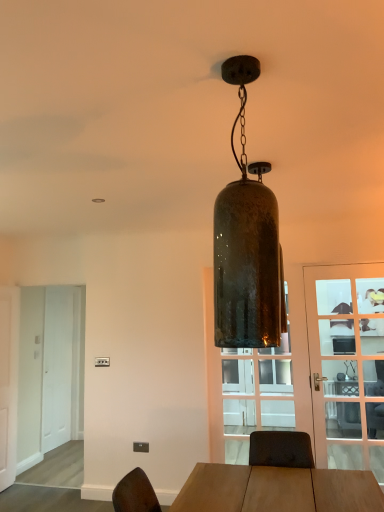
Question: Does green glass pendant light at center have a smaller size compared to white matte door at left, the 1th door from the left?

Choices:
 (A) no
 (B) yes

Answer: (B)

Question: Can you confirm if green glass pendant light at center is positioned to the left of white matte door at left, the 2th door viewed from the right?

Choices:
 (A) no
 (B) yes

Answer: (A)

Question: Considering the relative sizes of green glass pendant light at center and white matte door at left, the 1th door from the left, in the image provided, is green glass pendant light at center wider than white matte door at left, the 1th door from the left,?

Choices:
 (A) no
 (B) yes

Answer: (B)

Question: Is green glass pendant light at center placed right next to white matte door at left, the 2th door viewed from the right?

Choices:
 (A) no
 (B) yes

Answer: (A)

Question: Does green glass pendant light at center turn towards white matte door at left, the 2th door viewed from the right?

Choices:
 (A) yes
 (B) no

Answer: (B)

Question: From a real-world perspective, is white matte door at left, positioned as the second screen door in back-to-front order, positioned above or below clear glass door at center right, the first door positioned from the right?

Choices:
 (A) below
 (B) above

Answer: (A)

Question: Based on their positions, is white matte door at left, positioned as the second screen door in back-to-front order, located to the left or right of clear glass door at center right, which is the second door in left-to-right order?

Choices:
 (A) left
 (B) right

Answer: (A)

Question: Considering their positions, is white matte door at left, marked as the first screen door in a front-to-back arrangement, located in front of or behind clear glass door at center right, which is the second door in left-to-right order?

Choices:
 (A) behind
 (B) front

Answer: (A)

Question: Considering the positions of white matte door at left, positioned as the second screen door in back-to-front order, and clear glass door at center right, which appears as the first door when viewed from the front, in the image, is white matte door at left, positioned as the second screen door in back-to-front order, taller or shorter than clear glass door at center right, which appears as the first door when viewed from the front,?

Choices:
 (A) short
 (B) tall

Answer: (B)

Question: From a real-world perspective, is white wooden screen door at left, which is the second screen door in front-to-back order, positioned above or below clear glass door at center right, which appears as the first door when viewed from the front?

Choices:
 (A) above
 (B) below

Answer: (B)

Question: From the image's perspective, is white wooden screen door at left, which is the second screen door in front-to-back order, located above or below clear glass door at center right, the first door positioned from the right?

Choices:
 (A) above
 (B) below

Answer: (B)

Question: Considering the positions of white wooden screen door at left, the first screen door positioned from the back, and clear glass door at center right, which is the second door in left-to-right order, in the image, is white wooden screen door at left, the first screen door positioned from the back, bigger or smaller than clear glass door at center right, which is the second door in left-to-right order,?

Choices:
 (A) small
 (B) big

Answer: (B)

Question: Does point (62, 322) appear closer or farther from the camera than point (374, 330)?

Choices:
 (A) farther
 (B) closer

Answer: (A)

Question: Choose the correct answer: Is green glass pendant light at center inside transparent glass door at center or outside it?

Choices:
 (A) outside
 (B) inside

Answer: (A)

Question: Is green glass pendant light at center taller or shorter than transparent glass door at center?

Choices:
 (A) tall
 (B) short

Answer: (B)